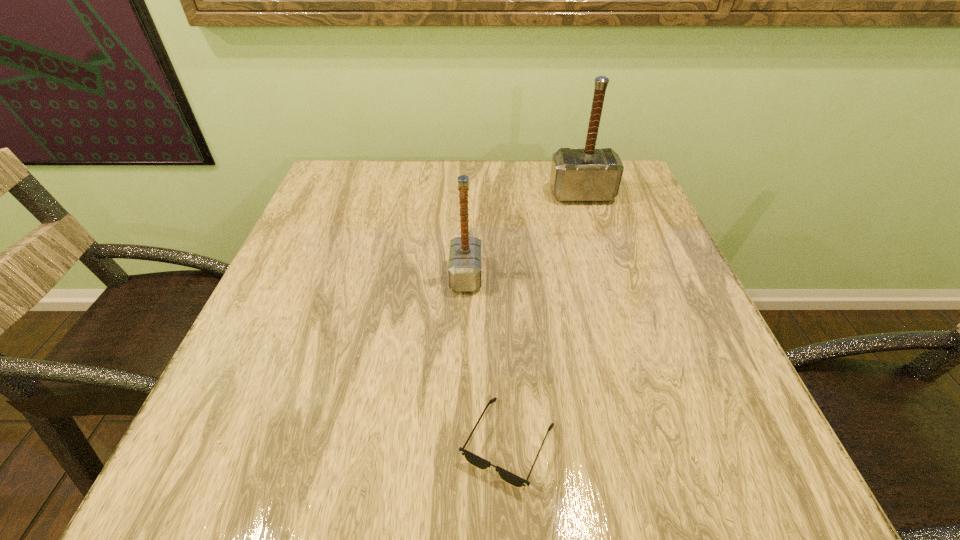
The height and width of the screenshot is (540, 960). Find the location of `free space between the shorter hammer and the farther hammer`. free space between the shorter hammer and the farther hammer is located at coordinates (524, 235).

Image resolution: width=960 pixels, height=540 pixels. I want to click on vacant area between the rightmost object and the shortest object, so click(545, 319).

I want to click on free space between the shortest object and the taller hammer, so click(x=545, y=319).

You are a GUI agent. You are given a task and a screenshot of the screen. Output one action in this format:
    pyautogui.click(x=<x>, y=<y>)
    Task: Click on the empty location between the second nearest object and the taller hammer
    
    Given the screenshot: What is the action you would take?
    pyautogui.click(x=524, y=235)

Where is `free space between the nearer hammer and the nearest object`? The width and height of the screenshot is (960, 540). free space between the nearer hammer and the nearest object is located at coordinates 487,359.

In order to click on vacant area that lies between the farthest object and the second nearest object in this screenshot , I will do tap(524, 235).

You are a GUI agent. You are given a task and a screenshot of the screen. Output one action in this format:
    pyautogui.click(x=<x>, y=<y>)
    Task: Click on the vacant space in between the second tallest object and the sunglasses
    The width and height of the screenshot is (960, 540).
    Given the screenshot: What is the action you would take?
    pyautogui.click(x=487, y=359)

At what (x,y) coordinates should I click in order to perform the action: click on the second closest object relative to the right hammer. Please return your answer as a coordinate pair (x, y). Looking at the image, I should click on (510, 478).

You are a GUI agent. You are given a task and a screenshot of the screen. Output one action in this format:
    pyautogui.click(x=<x>, y=<y>)
    Task: Click on the second closest object to the farther hammer
    The image size is (960, 540).
    Given the screenshot: What is the action you would take?
    pyautogui.click(x=510, y=478)

Identify the location of vacant position in the image that satisfies the following two spatial constraints: 1. on the front side of the right hammer; 2. on the striking surface of the second tallest object. click(x=607, y=275).